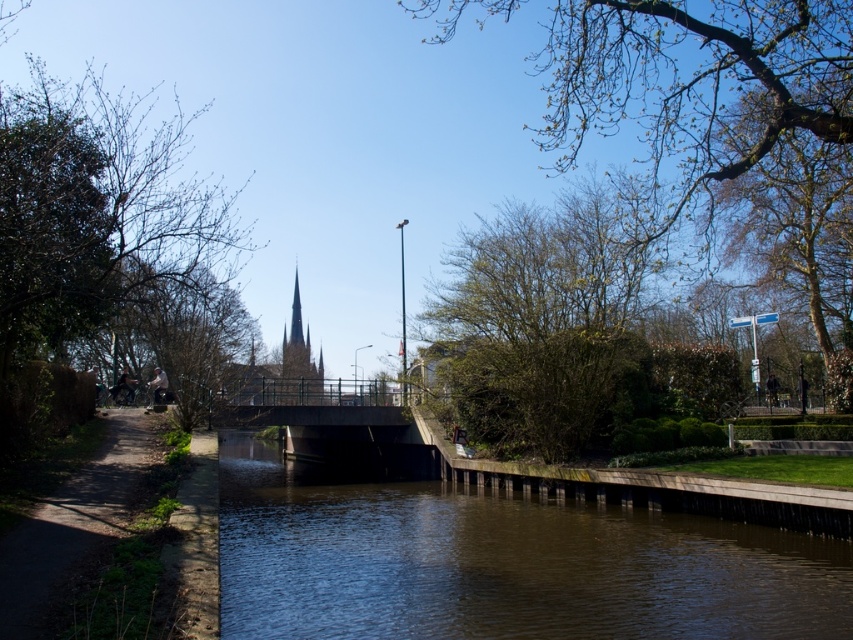
Does point (287, 378) come closer to viewer compared to point (300, 333)?

That is True.

Can you confirm if dark brown stone tower at center is taller than smooth gray spire at center?

Indeed, dark brown stone tower at center has a greater height compared to smooth gray spire at center.

Which is in front, point (300, 385) or point (299, 344)?

Point (300, 385) is more forward.

Where is `dark brown stone tower at center`? The height and width of the screenshot is (640, 853). dark brown stone tower at center is located at coordinates (299, 356).

Consider the image. Is bare branches at left smaller than green leafy tree at upper right?

Correct, bare branches at left occupies less space than green leafy tree at upper right.

Is bare branches at left positioned before green leafy tree at upper right?

Yes, it is in front of green leafy tree at upper right.

Between point (1, 29) and point (659, 108), which one is positioned behind?

Positioned behind is point (659, 108).

Image resolution: width=853 pixels, height=640 pixels. I want to click on bare branches at left, so click(x=90, y=228).

Is brown concrete river at center to the right of dark brown stone tower at center from the viewer's perspective?

Correct, you'll find brown concrete river at center to the right of dark brown stone tower at center.

Does point (477, 636) lie in front of point (292, 321)?

Yes, it is in front of point (292, 321).

This screenshot has height=640, width=853. I want to click on brown concrete river at center, so click(x=500, y=563).